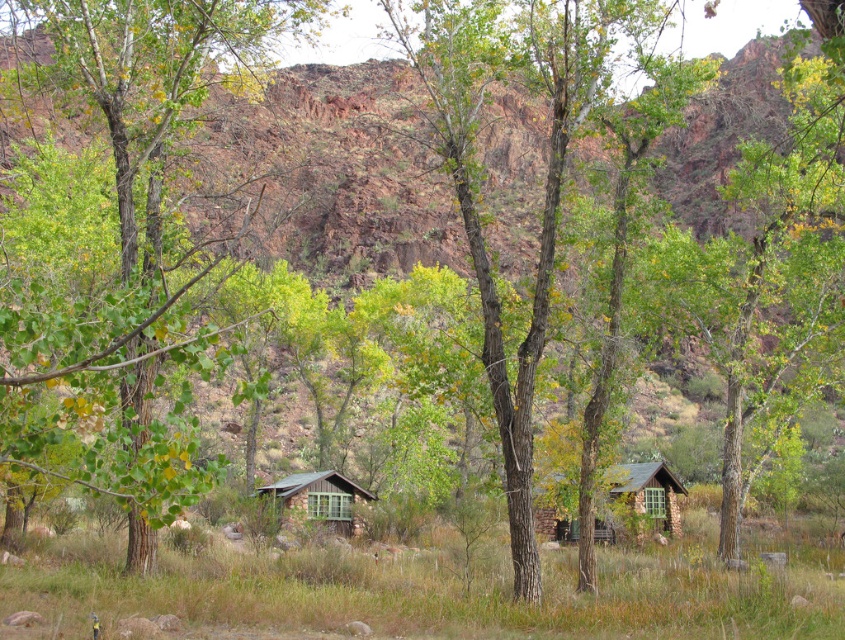
You are planning to set up a tent between the rustic stone cabin at center and the wooden cabin at center. Which cabin has more space available next to it for the tent?

The rustic stone cabin at center is wider than the wooden cabin at center, so there might be more space next to it for the tent.

You are standing in the valley looking at the two cabins. There are two points marked as point 1 and point 2. Point 1 is at coordinate (151, 324) and point 2 is at (335, 493). If you want to walk towards the cabin that is closer to you, which point should you head towards?

Point 1 is in front of point 2, so you should head towards point 1 to reach the cabin closer to you.